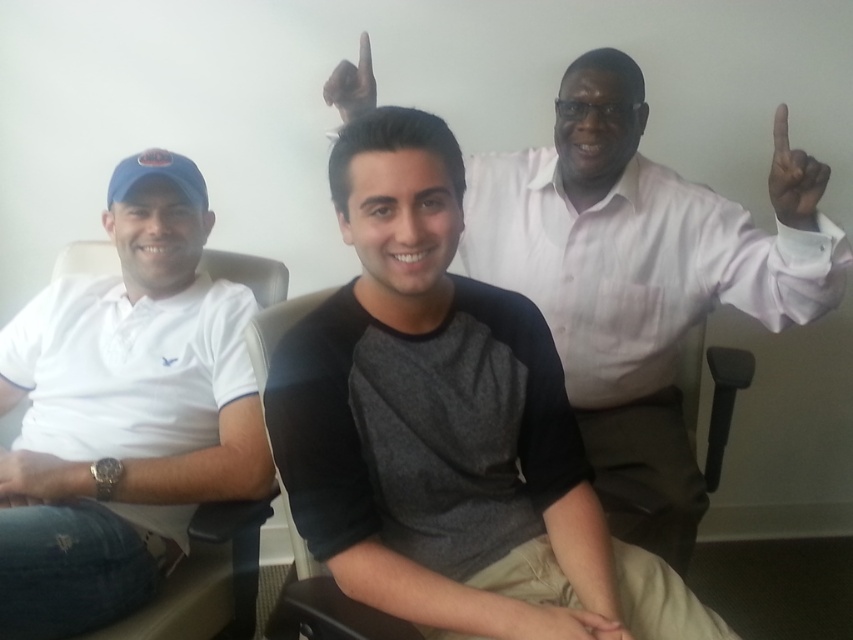
You are a photographer standing in the room. You want to take a photo of the white cotton polo shirt at left and black matte hand at upper right. Can you fit both subjects in the frame of your camera which has a 1.2 meter wide field of view?

The white cotton polo shirt at left is 1.13 meters from the black matte hand at upper right. Since the distance between them is less than the camera frame width of 1.2 meters, both subjects can fit in the frame.

You are standing in front of the image and want to reach the point at coordinates point [132,432]. Can you walk towards it?

The point at coordinates point [132,432] is 4.41 feet away from you, so yes, you can walk towards it.